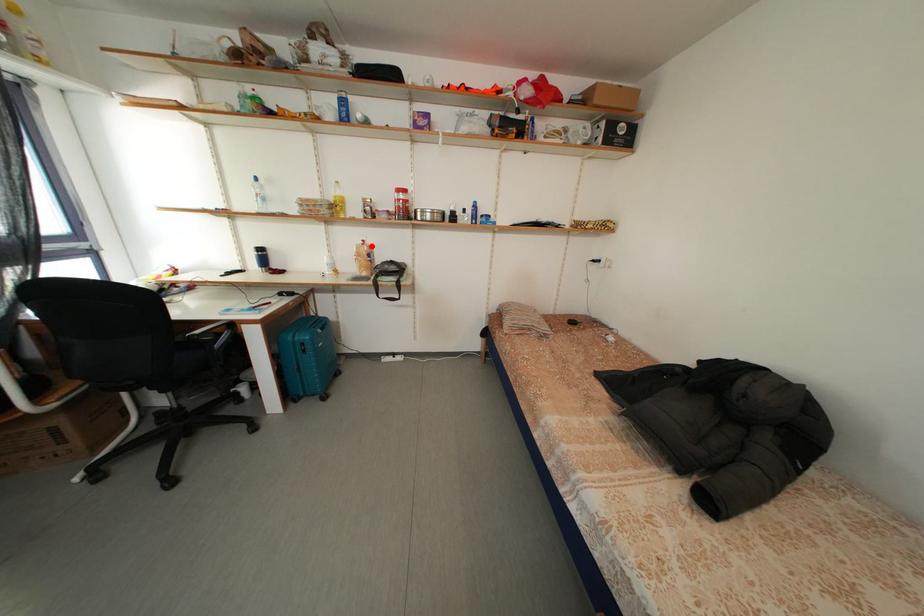
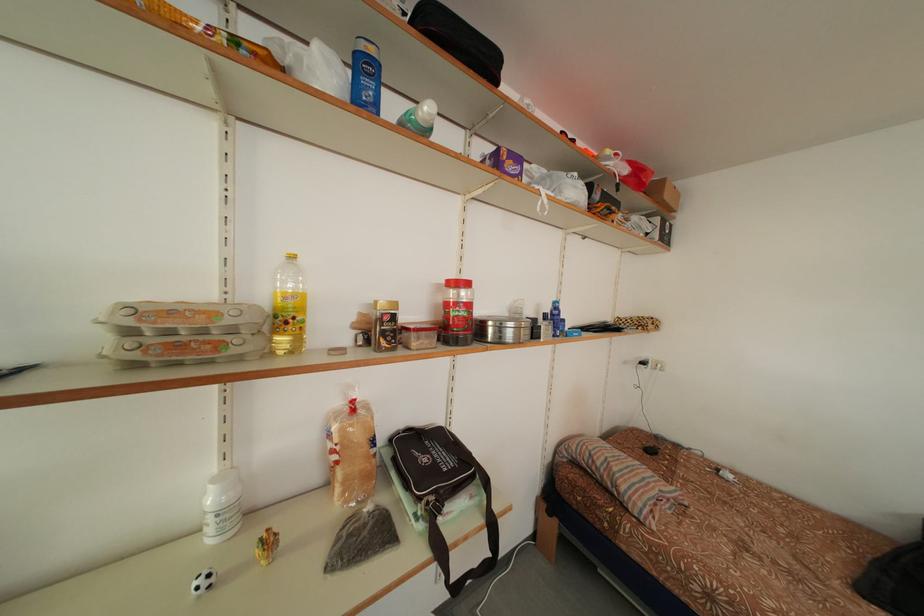
Question: I am providing you with two images of the same scene from different viewpoints. Given a red point in image1, look at the same physical point in image2. Is it:

Choices:
 (A) Closer to the viewpoint
 (B) Farther from the viewpoint

Answer: (B)